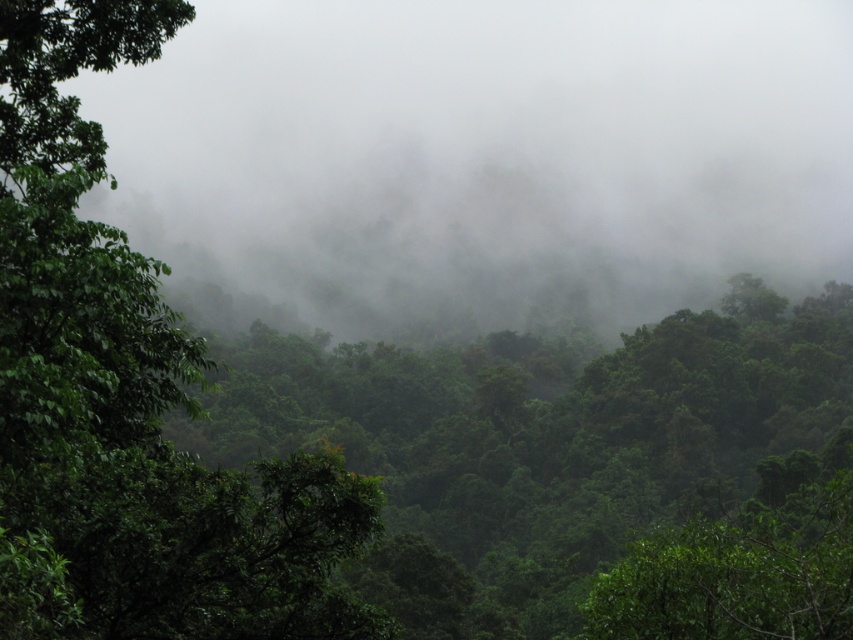
You are a hiker who wants to reach the green leafy tree at left from your current position near the white misty fog at upper center. Considering the dense forest and mist, do you think you can see the tree clearly while walking towards it?

The distance between the white misty fog at upper center and the green leafy tree at left is 2059.45 feet. Due to the dense forest and thick mist, visibility is limited, so you may not see the tree clearly while walking towards it.

You are a hiker trying to navigate through the forest. You see the white misty fog at upper center. Can you estimate its location in terms of coordinates?

The white misty fog at upper center is located at coordinates point (486, 156).